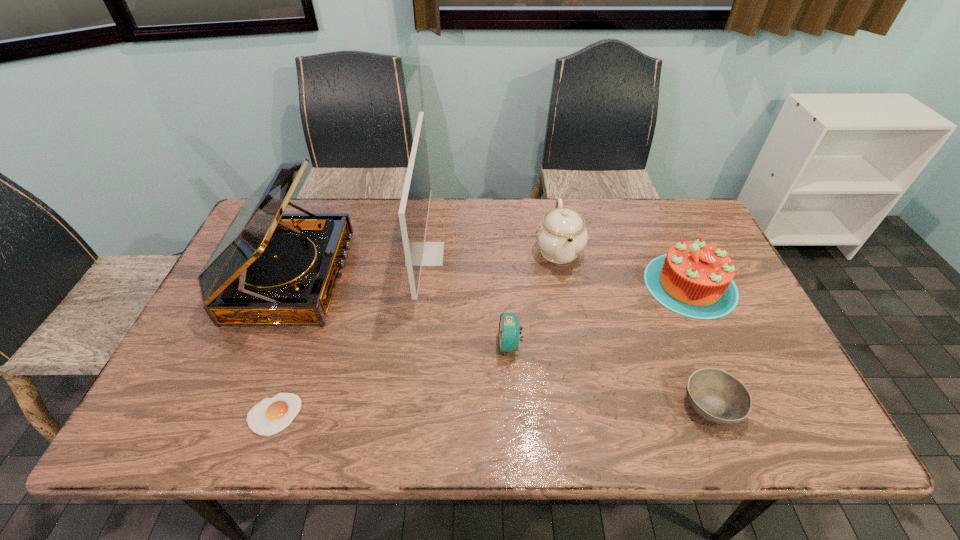
Identify which object is located as the third nearest to the egg yolk. Please provide its 2D coordinates. Your answer should be formatted as a tuple, i.e. [(x, y)], where the tuple contains the x and y coordinates of a point satisfying the conditions above.

[(509, 332)]

The width and height of the screenshot is (960, 540). In order to click on free location that satisfies the following two spatial constraints: 1. at the spout of the fifth object from left to right; 2. on the front-facing side of the alarm clock in this screenshot , I will do `click(576, 345)`.

This screenshot has width=960, height=540. I want to click on vacant space that satisfies the following two spatial constraints: 1. on the front-facing side of the sixth tallest object; 2. on the right side of the monitor, so click(x=406, y=404).

Where is `vacant point that satisfies the following two spatial constraints: 1. on the back side of the bowl; 2. on the front-facing side of the alarm clock`? This screenshot has height=540, width=960. vacant point that satisfies the following two spatial constraints: 1. on the back side of the bowl; 2. on the front-facing side of the alarm clock is located at coordinates click(687, 345).

You are a GUI agent. You are given a task and a screenshot of the screen. Output one action in this format:
    pyautogui.click(x=<x>, y=<y>)
    Task: Click on the vacant area in the image that satisfies the following two spatial constraints: 1. on the front-facing side of the second tallest object; 2. on the right side of the egg yolk
    The image size is (960, 540).
    Given the screenshot: What is the action you would take?
    pyautogui.click(x=234, y=415)

This screenshot has height=540, width=960. In order to click on vacant area that satisfies the following two spatial constraints: 1. on the front-facing side of the record player; 2. on the left side of the egg yolk in this screenshot , I will do `click(234, 415)`.

Find the location of `vacant space that satisfies the following two spatial constraints: 1. on the front-facing side of the sixth shortest object; 2. on the right side of the cake`. vacant space that satisfies the following two spatial constraints: 1. on the front-facing side of the sixth shortest object; 2. on the right side of the cake is located at coordinates (288, 284).

You are a GUI agent. You are given a task and a screenshot of the screen. Output one action in this format:
    pyautogui.click(x=<x>, y=<y>)
    Task: Click on the vacant space that satisfies the following two spatial constraints: 1. on the back side of the cake; 2. on the front-facing side of the record player
    This screenshot has height=540, width=960.
    Given the screenshot: What is the action you would take?
    pyautogui.click(x=686, y=276)